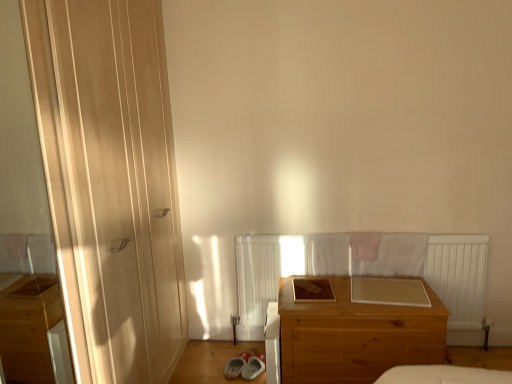
What do you see at coordinates (21, 159) in the screenshot?
I see `transparent glass screen door at left` at bounding box center [21, 159].

The image size is (512, 384). Identify the location of transparent glass screen door at left. point(21,159).

Who is smaller, matte wood door at left or transparent glass screen door at left?

With smaller size is transparent glass screen door at left.

From the image's perspective, is matte wood door at left over transparent glass screen door at left?

Yes, from the image's perspective, matte wood door at left is over transparent glass screen door at left.

From the picture: Does matte wood door at left appear on the right side of transparent glass screen door at left?

Yes, matte wood door at left is to the right of transparent glass screen door at left.

Is the surface of matte wood door at left in direct contact with transparent glass screen door at left?

They are not placed beside each other.

Who is taller, transparent glass screen door at left or wooden chest of drawers at center?

Standing taller between the two is transparent glass screen door at left.

Between point (46, 377) and point (311, 374), which one is positioned in front?

The point (311, 374) is closer.

In the scene shown: How many degrees apart are the facing directions of transparent glass screen door at left and wooden chest of drawers at center?

86.8 degrees separate the facing orientations of transparent glass screen door at left and wooden chest of drawers at center.

Where is `screen door lying in front of the wooden chest of drawers at center`? The height and width of the screenshot is (384, 512). screen door lying in front of the wooden chest of drawers at center is located at coordinates (21, 159).

From the image's perspective, is wooden chest of drawers at center located above or below transparent glass screen door at left?

From the image's perspective, wooden chest of drawers at center appears below transparent glass screen door at left.

You are a GUI agent. You are given a task and a screenshot of the screen. Output one action in this format:
    pyautogui.click(x=<x>, y=<y>)
    Task: Click on the screen door in front of the wooden chest of drawers at center
    The width and height of the screenshot is (512, 384).
    Given the screenshot: What is the action you would take?
    pyautogui.click(x=21, y=159)

Which of these two, wooden chest of drawers at center or transparent glass screen door at left, is bigger?

With larger size is wooden chest of drawers at center.

From the picture: Which of these two, transparent glass screen door at left or matte wood door at left, is smaller?

transparent glass screen door at left is smaller.

Where is `screen door in front of the matte wood door at left`? This screenshot has width=512, height=384. screen door in front of the matte wood door at left is located at coordinates (21, 159).

Is transparent glass screen door at left taller or shorter than matte wood door at left?

transparent glass screen door at left is shorter than matte wood door at left.

From a real-world perspective, is matte wood door at left above or below wooden chest of drawers at center?

In terms of real-world spatial position, matte wood door at left is above wooden chest of drawers at center.

Locate an element on the screen. This screenshot has width=512, height=384. chest of drawers below the matte wood door at left (from the image's perspective) is located at coordinates (356, 336).

Consider the image. Can you confirm if matte wood door at left is thinner than wooden chest of drawers at center?

Indeed, matte wood door at left has a lesser width compared to wooden chest of drawers at center.

What's the angular difference between matte wood door at left and wooden chest of drawers at center's facing directions?

86.8 degrees.

Considering the positions of points (356, 372) and (133, 298), is point (356, 372) closer to camera compared to point (133, 298)?

That is False.

Is wooden chest of drawers at center closer to the viewer compared to matte wood door at left?

That is False.

Find the location of a particular element. The image size is (512, 384). door on the left of wooden chest of drawers at center is located at coordinates (110, 182).

Image resolution: width=512 pixels, height=384 pixels. Identify the location of screen door located in front of the matte wood door at left. pyautogui.click(x=21, y=159).

At what (x,y) coordinates should I click in order to perform the action: click on chest of drawers on the right of transparent glass screen door at left. Please return your answer as a coordinate pair (x, y). Looking at the image, I should click on (356, 336).

When comparing their distances from transparent glass screen door at left, does matte wood door at left or wooden chest of drawers at center seem closer?

Among the two, matte wood door at left is located nearer to transparent glass screen door at left.

From the image, which object appears to be farther from matte wood door at left, wooden chest of drawers at center or transparent glass screen door at left?

transparent glass screen door at left is further to matte wood door at left.

Looking at the image, which one is located closer to wooden chest of drawers at center, matte wood door at left or transparent glass screen door at left?

Based on the image, matte wood door at left appears to be nearer to wooden chest of drawers at center.

Looking at the image, which one is located closer to matte wood door at left, transparent glass screen door at left or wooden chest of drawers at center?

wooden chest of drawers at center is closer to matte wood door at left.

Looking at the image, which one is located closer to wooden chest of drawers at center, transparent glass screen door at left or matte wood door at left?

matte wood door at left is positioned closer to the anchor wooden chest of drawers at center.

Considering their positions, is wooden chest of drawers at center positioned further to transparent glass screen door at left than matte wood door at left?

wooden chest of drawers at center is positioned further to the anchor transparent glass screen door at left.

What are the coordinates of `door located between transparent glass screen door at left and wooden chest of drawers at center in the left-right direction` in the screenshot? It's located at (110, 182).